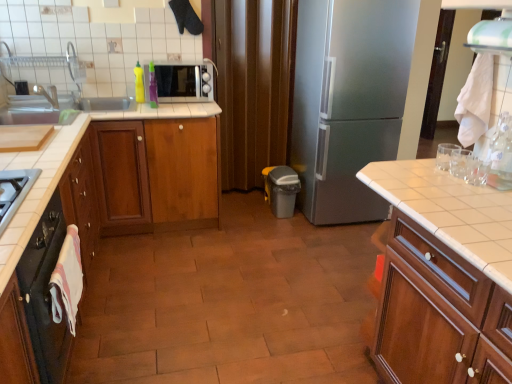
Question: From the image's perspective, is green plastic bottle at upper left, which is the 2th bottle from right to left, above or below white glossy exhaust hood at upper right?

Choices:
 (A) below
 (B) above

Answer: (B)

Question: Does point [148, 82] appear closer or farther from the camera than point [501, 46]?

Choices:
 (A) closer
 (B) farther

Answer: (B)

Question: Which object is positioned closest to the white glossy microwave at upper center?

Choices:
 (A) wooden cabinet at right, which ranks as the 1th cabinetry in right-to-left order
 (B) satin silver refrigerator at center
 (C) green plastic bottle at upper left, positioned as the second bottle in left-to-right order
 (D) white tile countertop at right
 (E) satin silver gas stove at lower left

Answer: (C)

Question: Which is nearer to the satin silver refrigerator at center?

Choices:
 (A) yellow matte bottle at upper left, positioned as the third bottle in bottom-to-top order
 (B) brown matte curtain at center
 (C) wooden cabinet at center, the third cabinetry viewed from the left
 (D) white glossy exhaust hood at upper right
 (E) wooden cabinet at right, which is counted as the fourth cabinetry, starting from the left

Answer: (B)